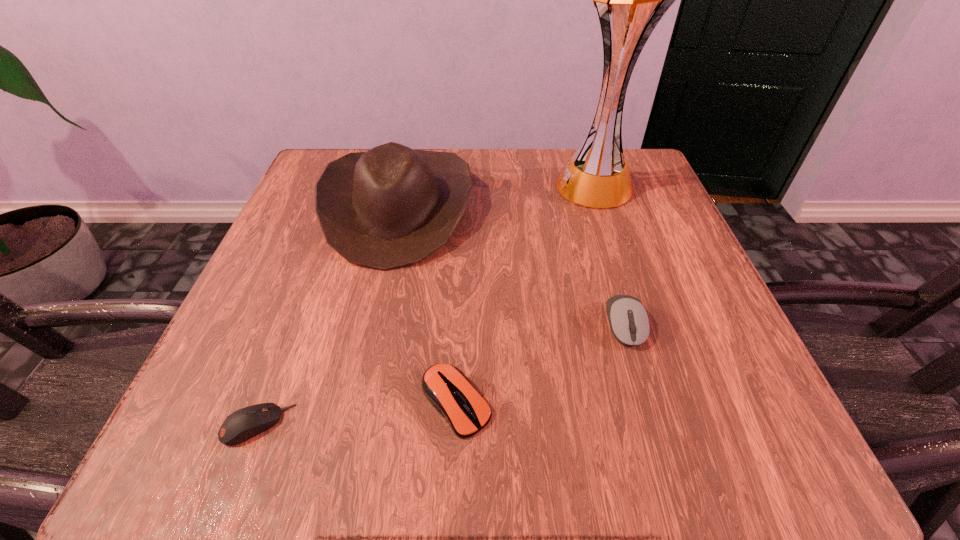
This screenshot has width=960, height=540. I want to click on vacant area at the near right corner, so click(x=746, y=433).

At what (x,y) coordinates should I click in order to perform the action: click on vacant space that is in between the cowboy hat and the second shortest computer mouse. Please return your answer as a coordinate pair (x, y). Looking at the image, I should click on (427, 305).

You are a GUI agent. You are given a task and a screenshot of the screen. Output one action in this format:
    pyautogui.click(x=<x>, y=<y>)
    Task: Click on the empty location between the farthest computer mouse and the trophy
    Image resolution: width=960 pixels, height=540 pixels.
    Given the screenshot: What is the action you would take?
    pyautogui.click(x=611, y=255)

The image size is (960, 540). I want to click on free space between the tallest object and the fourth shortest object, so click(x=497, y=197).

Locate an element on the screen. vacant space in between the second shortest computer mouse and the trophy is located at coordinates (526, 294).

Locate an element on the screen. Image resolution: width=960 pixels, height=540 pixels. free space between the rightmost computer mouse and the tallest object is located at coordinates (611, 255).

The height and width of the screenshot is (540, 960). I want to click on blank region between the leftmost computer mouse and the fourth shortest object, so pos(327,316).

Identify the location of free point between the rightmost computer mouse and the tallest object. (611, 255).

I want to click on free point between the fourth shortest object and the leftmost computer mouse, so click(x=327, y=316).

Locate an element on the screen. free spot between the second computer mouse from left to right and the second tallest object is located at coordinates (427, 305).